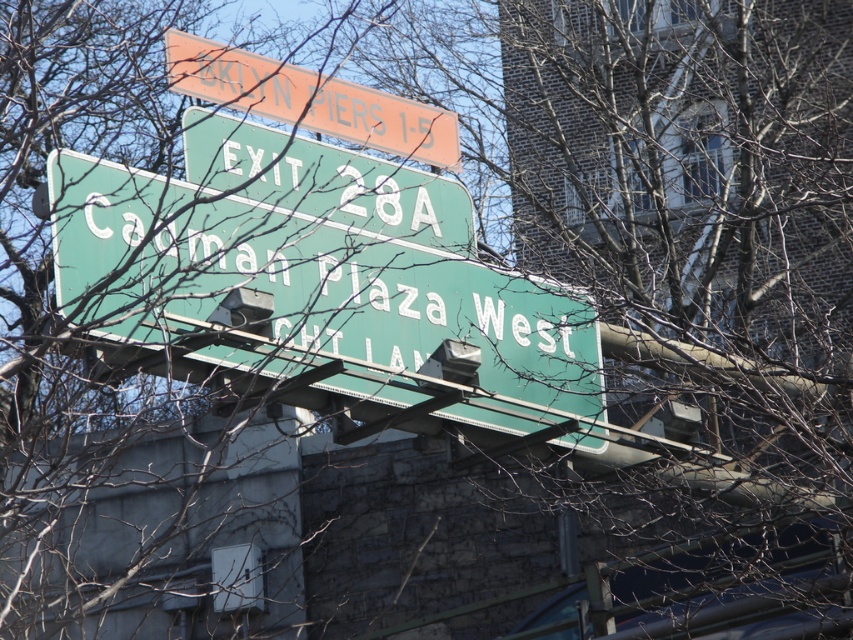
You are a driver approaching an intersection and see the green metallic sign at center and the orange plastic sign at upper center. Which sign is located above the other?

The orange plastic sign at upper center is above the green metallic sign at center because the green metallic sign at center is positioned under it.

You are a driver approaching the green metallic sign at center. Based on its position, can you estimate where exactly it is located in the image?

The green metallic sign at center is located at the coordinates point (318, 300) in the image.